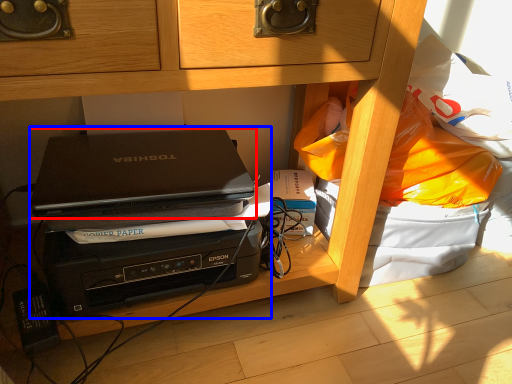
Question: Which of the following is the closest to the observer, laptop (highlighted by a red box) or computer (highlighted by a blue box)?

Choices:
 (A) laptop
 (B) computer

Answer: (A)